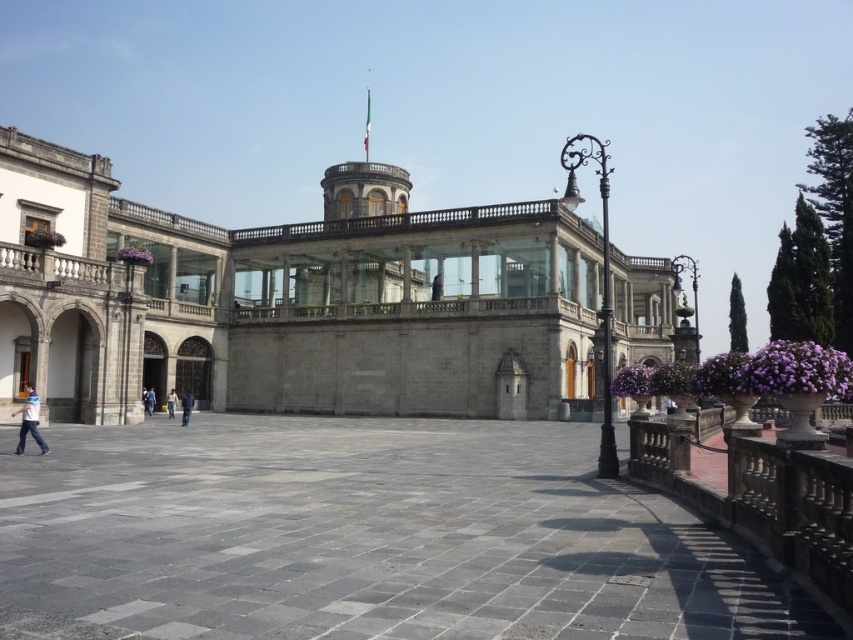
You are standing at the point marked as point (476,268) in the courtyard of the historical building. You need to walk to the entrance of the building, which is at the opposite end. How far will you have to walk?

You will have to walk 270.00 feet to reach the entrance of the building from point (476,268).